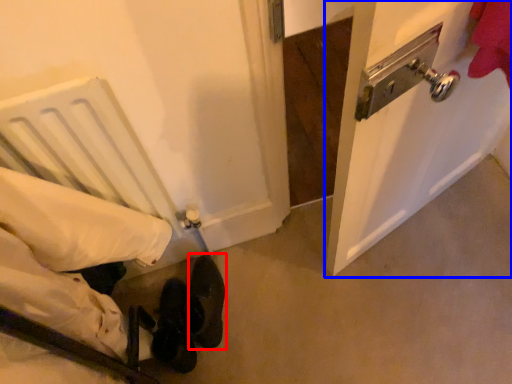
Question: Which object is further to the camera taking this photo, footwear (highlighted by a red box) or door (highlighted by a blue box)?

Choices:
 (A) footwear
 (B) door

Answer: (A)